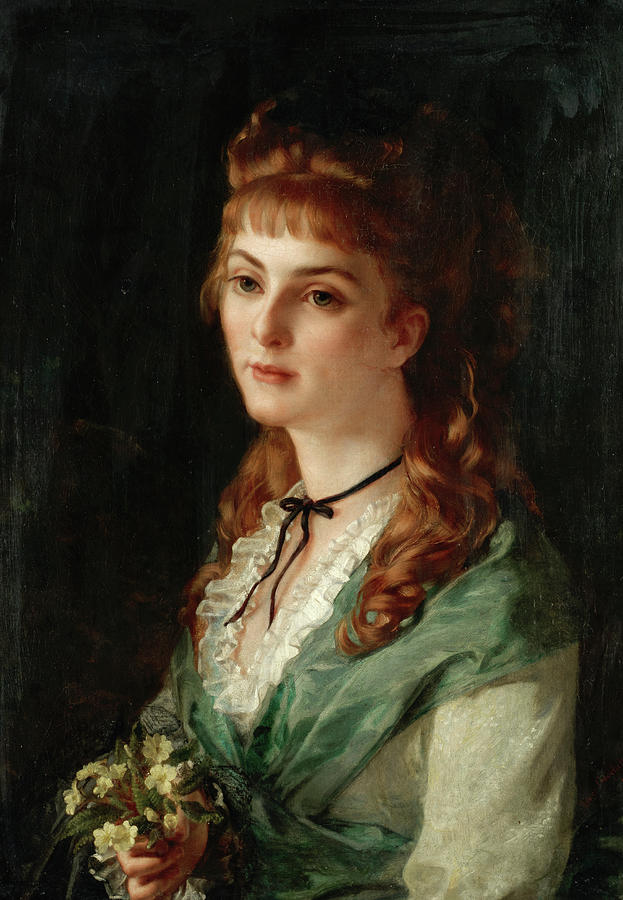
Identify the location of painting. The height and width of the screenshot is (900, 623). [x=361, y=352].